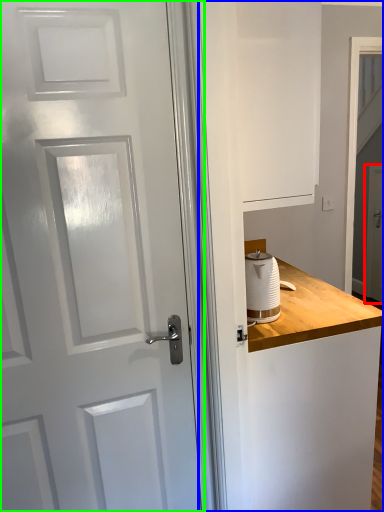
Question: Which object is positioned farthest from screen door (highlighted by a red box)? Select from dresser (highlighted by a blue box) and door (highlighted by a green box).

Choices:
 (A) dresser
 (B) door

Answer: (B)